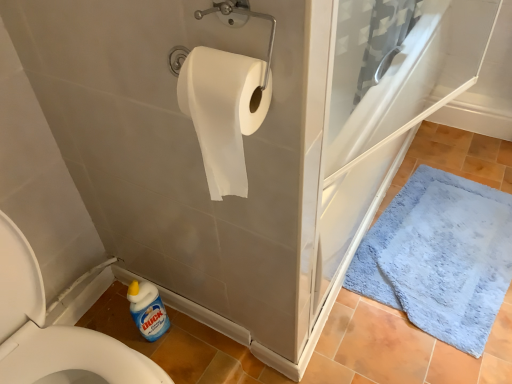
Find the location of a particular element. The height and width of the screenshot is (384, 512). blue plush bath mat at lower right is located at coordinates (440, 257).

Is the depth of white paper towel at left less than that of blue plastic bottle at lower left?

Yes, white paper towel at left is closer to the viewer.

Is white paper towel at left inside the boundaries of blue plastic bottle at lower left, or outside?

white paper towel at left is outside blue plastic bottle at lower left.

Does white paper towel at left have a greater width compared to blue plastic bottle at lower left?

Yes.

Considering the sizes of objects white paper towel at left and blue plastic bottle at lower left in the image provided, who is smaller, white paper towel at left or blue plastic bottle at lower left?

blue plastic bottle at lower left is smaller.

In order to click on toilet paper in front of the blue plastic bottle at lower left in this screenshot , I will do `click(224, 112)`.

Is blue plastic bottle at lower left positioned far away from white matte toilet paper at upper center?

No, there isn't a large distance between blue plastic bottle at lower left and white matte toilet paper at upper center.

Which is more to the right, blue plastic bottle at lower left or white matte toilet paper at upper center?

From the viewer's perspective, white matte toilet paper at upper center appears more on the right side.

Considering the positions of objects blue plush bath mat at lower right and blue plastic bottle at lower left in the image provided, who is behind, blue plush bath mat at lower right or blue plastic bottle at lower left?

blue plush bath mat at lower right is further from the camera.

From the picture: Which is further, (465, 263) or (149, 300)?

Point (465, 263)

In terms of height, does blue plush bath mat at lower right look taller or shorter compared to blue plastic bottle at lower left?

In the image, blue plush bath mat at lower right appears to be shorter than blue plastic bottle at lower left.

Which is more to the right, blue plush bath mat at lower right or blue plastic bottle at lower left?

blue plush bath mat at lower right is more to the right.

Considering the sizes of objects white matte toilet paper at upper center and blue plastic bottle at lower left in the image provided, who is thinner, white matte toilet paper at upper center or blue plastic bottle at lower left?

With smaller width is blue plastic bottle at lower left.

Looking at the image, does white matte toilet paper at upper center seem bigger or smaller compared to blue plastic bottle at lower left?

Considering their sizes, white matte toilet paper at upper center takes up more space than blue plastic bottle at lower left.

From the image's perspective, between white matte toilet paper at upper center and blue plastic bottle at lower left, who is located below?

blue plastic bottle at lower left, from the image's perspective.

Is the depth of white matte toilet paper at upper center greater than that of blue plastic bottle at lower left?

No, it is in front of blue plastic bottle at lower left.

Looking at the image, does white matte toilet paper at upper center seem bigger or smaller compared to white paper towel at left?

white matte toilet paper at upper center is smaller than white paper towel at left.

Which is in front, point (205, 141) or point (106, 224)?

Point (205, 141)

Is white matte toilet paper at upper center behind white paper towel at left?

Yes, it is.

Based on their positions, is white matte toilet paper at upper center located to the left or right of white paper towel at left?

Based on their positions, white matte toilet paper at upper center is located to the right of white paper towel at left.

Which is less distant, (205, 68) or (465, 278)?

The point (205, 68) is closer.

Looking at the image, does white matte toilet paper at upper center seem bigger or smaller compared to blue plush bath mat at lower right?

Clearly, white matte toilet paper at upper center is smaller in size than blue plush bath mat at lower right.

Does white matte toilet paper at upper center have a greater width compared to blue plush bath mat at lower right?

Incorrect, the width of white matte toilet paper at upper center does not surpass that of blue plush bath mat at lower right.

Is white matte toilet paper at upper center looking in the opposite direction of blue plush bath mat at lower right?

No, white matte toilet paper at upper center is not facing the opposite direction of blue plush bath mat at lower right.

Is white paper towel at left positioned far away from blue plush bath mat at lower right?

No, there isn't a large distance between white paper towel at left and blue plush bath mat at lower right.

Which of these two, white paper towel at left or blue plush bath mat at lower right, is bigger?

Bigger between the two is white paper towel at left.

Is point (68, 157) farther from viewer compared to point (356, 260)?

No, (68, 157) is closer to viewer.

Considering the relative sizes of white paper towel at left and blue plush bath mat at lower right in the image provided, is white paper towel at left shorter than blue plush bath mat at lower right?

In fact, white paper towel at left may be taller than blue plush bath mat at lower right.

Image resolution: width=512 pixels, height=384 pixels. What are the coordinates of `bath above the blue plastic bottle at lower left (from a real-world perspective)` in the screenshot? It's located at (191, 156).

This screenshot has height=384, width=512. I want to click on toilet paper to the right of blue plastic bottle at lower left, so click(x=224, y=112).

Looking at this image, looking at the image, which one is located closer to blue plush bath mat at lower right, white paper towel at left or blue plastic bottle at lower left?

The object closer to blue plush bath mat at lower right is white paper towel at left.

When comparing their distances from white paper towel at left, does blue plastic bottle at lower left or white matte toilet paper at upper center seem closer?

white matte toilet paper at upper center is positioned closer to the anchor white paper towel at left.

Which object lies nearer to the anchor point white paper towel at left, blue plush bath mat at lower right or blue plastic bottle at lower left?

blue plastic bottle at lower left.

From the image, which object appears to be nearer to blue plastic bottle at lower left, white paper towel at left or blue plush bath mat at lower right?

The object closer to blue plastic bottle at lower left is white paper towel at left.

In the scene shown: Estimate the real-world distances between objects in this image. Which object is closer to white paper towel at left, white matte toilet paper at upper center or blue plush bath mat at lower right?

Among the two, white matte toilet paper at upper center is located nearer to white paper towel at left.

Looking at the image, which one is located closer to blue plastic bottle at lower left, blue plush bath mat at lower right or white paper towel at left?

The object closer to blue plastic bottle at lower left is white paper towel at left.

Considering their positions, is blue plush bath mat at lower right positioned closer to white matte toilet paper at upper center than white paper towel at left?

Based on the image, white paper towel at left appears to be nearer to white matte toilet paper at upper center.

From the image, which object appears to be farther from blue plush bath mat at lower right, blue plastic bottle at lower left or white paper towel at left?

The object further to blue plush bath mat at lower right is blue plastic bottle at lower left.

The image size is (512, 384). I want to click on toilet paper between white paper towel at left and blue plastic bottle at lower left from front to back, so click(x=224, y=112).

Locate an element on the screen. The image size is (512, 384). cleaning product situated between white paper towel at left and blue plush bath mat at lower right from left to right is located at coordinates (147, 310).

At what (x,y) coordinates should I click in order to perform the action: click on toilet paper between blue plastic bottle at lower left and blue plush bath mat at lower right. Please return your answer as a coordinate pair (x, y). The image size is (512, 384). Looking at the image, I should click on (224, 112).

This screenshot has height=384, width=512. What are the coordinates of `toilet paper between white paper towel at left and blue plush bath mat at lower right` in the screenshot? It's located at (224, 112).